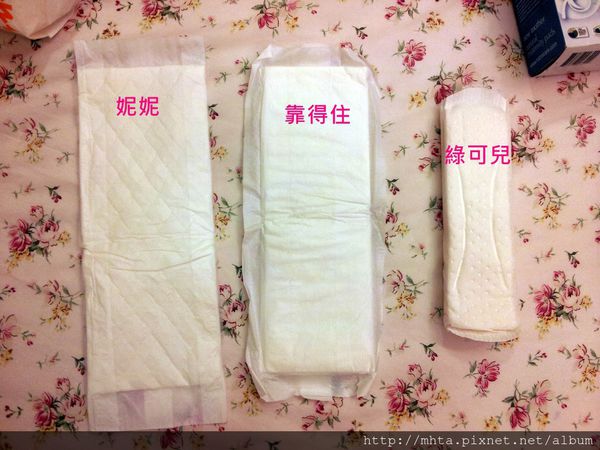
Find the location of a particular element. The width and height of the screenshot is (600, 450). floral tablecloth is located at coordinates (442, 39).